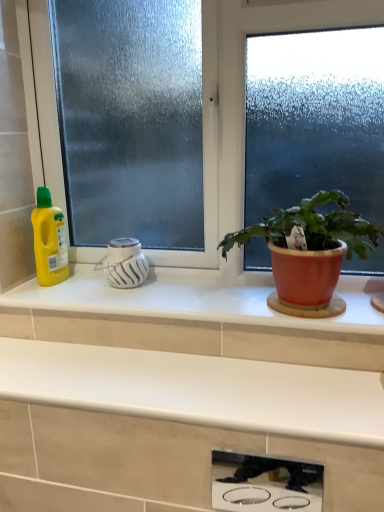
I want to click on blank space above white glossy countertop at center, which is the 1th countertop in top-to-bottom order (from a real-world perspective), so click(176, 291).